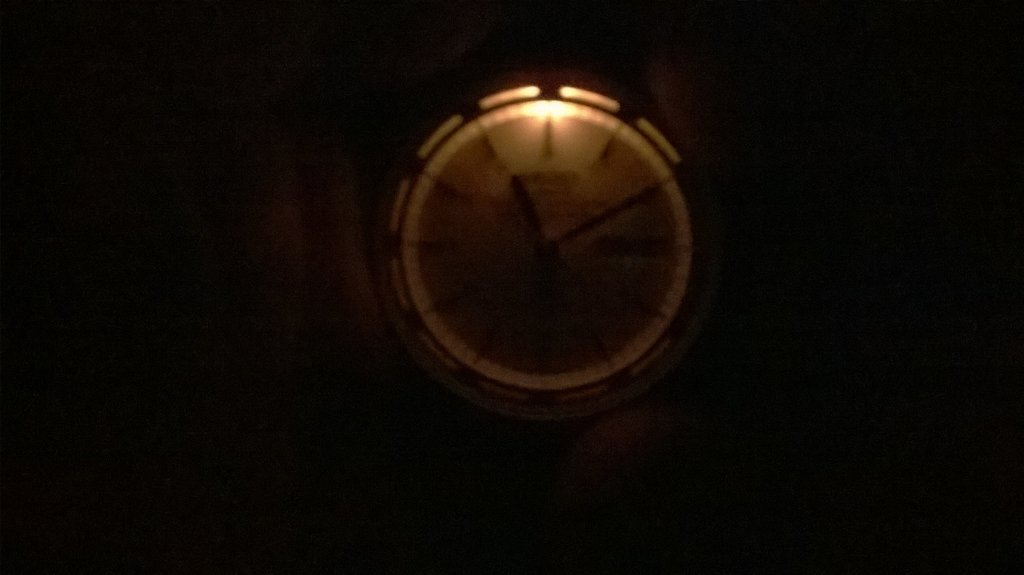
Identify the location of edge of clock. (684, 354), (421, 359), (384, 195).